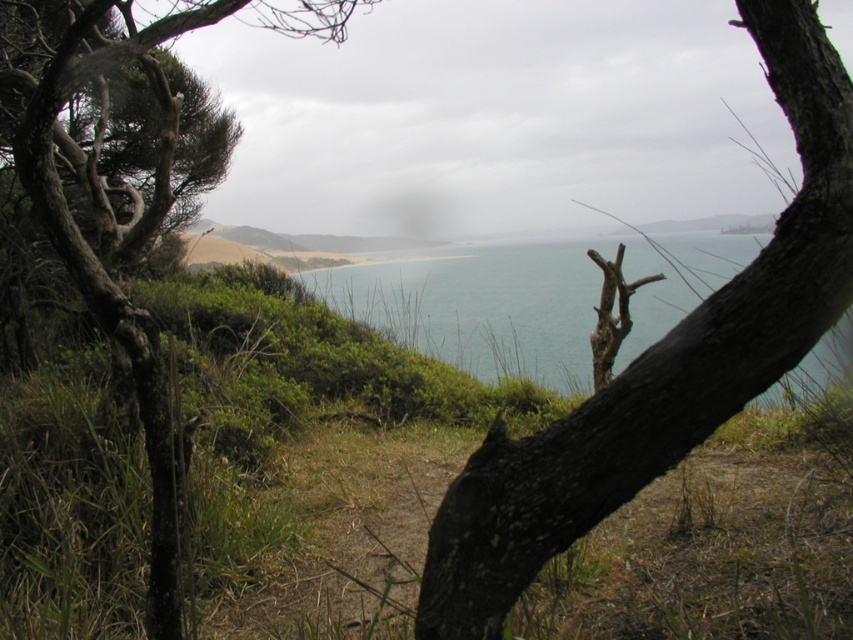
Is blue water at center to the right of brown rough bark tree at left from the viewer's perspective?

Yes, blue water at center is to the right of brown rough bark tree at left.

Which is more to the right, blue water at center or brown rough bark tree at left?

From the viewer's perspective, blue water at center appears more on the right side.

The height and width of the screenshot is (640, 853). What are the coordinates of `blue water at center` in the screenshot? It's located at (480, 307).

The image size is (853, 640). Find the location of `blue water at center`. blue water at center is located at coordinates (480, 307).

Is dark brown bark tree at center taller than brown rough bark tree at left?

No.

Is point (459, 476) farther from camera compared to point (96, 65)?

No.

Which is behind, point (607, 476) or point (171, 468)?

Positioned behind is point (171, 468).

Locate an element on the screen. dark brown bark tree at center is located at coordinates (660, 364).

Does dark brown bark tree at center appear on the right side of blue water at center?

Indeed, dark brown bark tree at center is positioned on the right side of blue water at center.

Is point (776, 225) in front of point (560, 348)?

That is True.

Is point (462, 474) positioned after point (445, 348)?

No, (462, 474) is in front of (445, 348).

Where is `dark brown bark tree at center`? The width and height of the screenshot is (853, 640). dark brown bark tree at center is located at coordinates (660, 364).